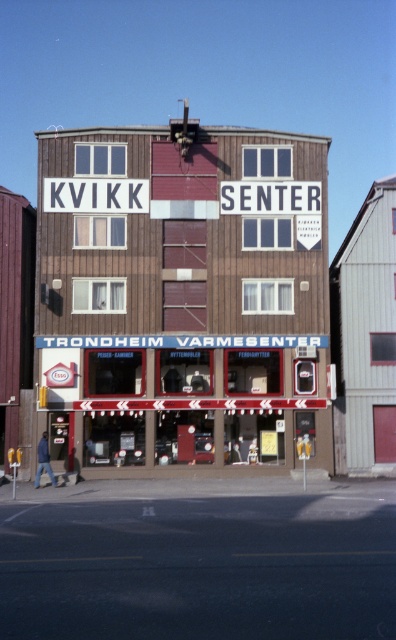
Question: Is white corrugated metal building at right below matte brown storefront at center?

Choices:
 (A) no
 (B) yes

Answer: (A)

Question: Which object appears closest to the camera in this image?

Choices:
 (A) matte brown storefront at center
 (B) brown wood paneling at center
 (C) white corrugated metal building at right

Answer: (B)

Question: Does brown wood paneling at center have a larger size compared to matte brown storefront at center?

Choices:
 (A) yes
 (B) no

Answer: (A)

Question: Which point is closer to the camera taking this photo?

Choices:
 (A) (194, 445)
 (B) (369, 410)

Answer: (A)

Question: Can you confirm if brown wood paneling at center is positioned to the right of matte brown storefront at center?

Choices:
 (A) yes
 (B) no

Answer: (B)

Question: Which object appears farthest from the camera in this image?

Choices:
 (A) white corrugated metal building at right
 (B) matte brown storefront at center

Answer: (A)